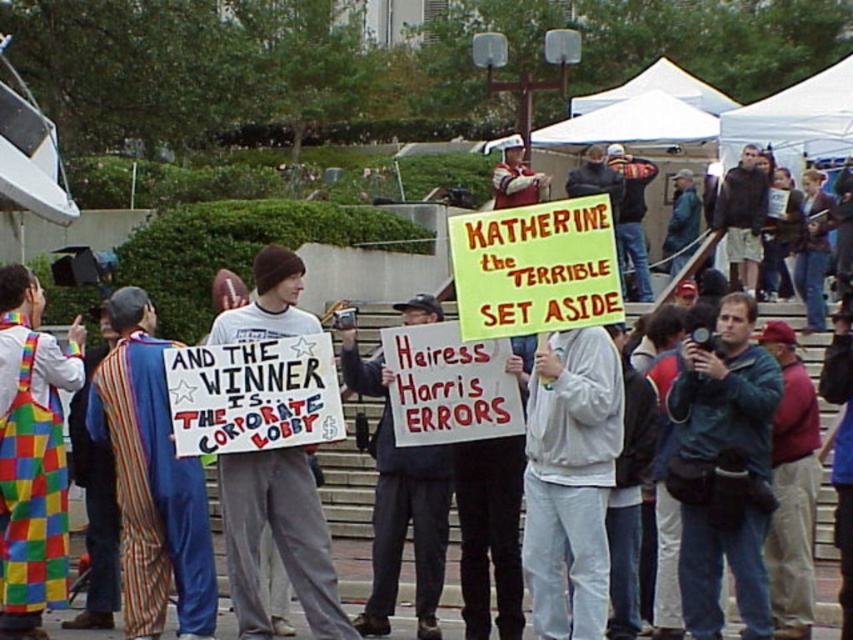
Is multicolored checkered apron at left shorter than white paper sign at center?

Incorrect, multicolored checkered apron at left's height does not fall short of white paper sign at center's.

Does multicolored checkered apron at left appear on the left side of white paper sign at center?

Yes, multicolored checkered apron at left is to the left of white paper sign at center.

Does point (61, 566) come farther from viewer compared to point (289, 262)?

Yes, it is.

Locate an element on the screen. multicolored checkered apron at left is located at coordinates (32, 456).

Who is lower down, striped fabric cape at left or multicolored checkered apron at left?

Positioned lower is striped fabric cape at left.

Does striped fabric cape at left appear on the right side of multicolored checkered apron at left?

Indeed, striped fabric cape at left is positioned on the right side of multicolored checkered apron at left.

Is point (142, 518) closer to viewer compared to point (62, 476)?

Yes, point (142, 518) is in front of point (62, 476).

Find the location of a particular element. The width and height of the screenshot is (853, 640). striped fabric cape at left is located at coordinates (151, 481).

Does point (131, 596) come behind point (224, 454)?

Yes, point (131, 596) is farther from viewer.

Does striped fabric cape at left have a smaller size compared to white paper sign at center?

Actually, striped fabric cape at left might be larger than white paper sign at center.

Locate an element on the screen. This screenshot has width=853, height=640. striped fabric cape at left is located at coordinates (151, 481).

Image resolution: width=853 pixels, height=640 pixels. Find the location of `striped fabric cape at left`. striped fabric cape at left is located at coordinates (151, 481).